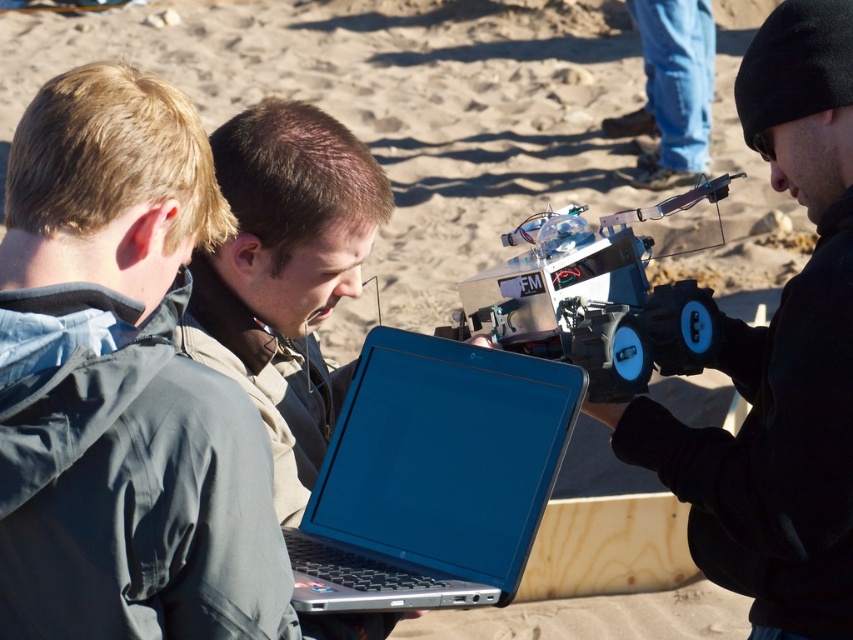
Question: Among these objects, which one is farthest from the camera?

Choices:
 (A) blue glossy laptop at center
 (B) metallic/plastic robot at center

Answer: (B)

Question: Considering the relative positions of gray fabric jacket at center and metallic/plastic robot at center in the image provided, where is gray fabric jacket at center located with respect to metallic/plastic robot at center?

Choices:
 (A) below
 (B) above

Answer: (A)

Question: Among these objects, which one is nearest to the camera?

Choices:
 (A) blue glossy laptop at center
 (B) black matte robot at center

Answer: (A)

Question: Is black matte robot at center positioned at the back of blue jeans at upper center?

Choices:
 (A) no
 (B) yes

Answer: (A)

Question: From the image, what is the correct spatial relationship of metallic/plastic robot at center in relation to blue jeans at upper center?

Choices:
 (A) above
 (B) below

Answer: (B)

Question: Which object appears farthest from the camera in this image?

Choices:
 (A) blue jeans at upper center
 (B) black matte robot at center

Answer: (A)